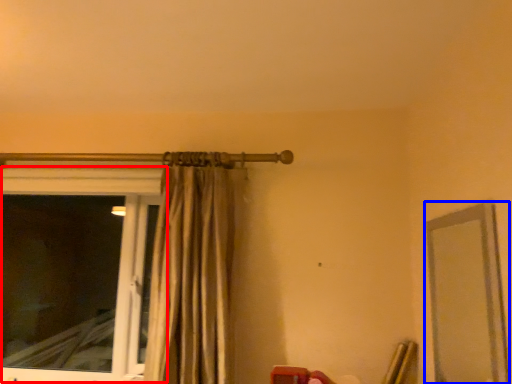
Question: Among these objects, which one is farthest to the camera, window (highlighted by a red box) or mirror (highlighted by a blue box)?

Choices:
 (A) window
 (B) mirror

Answer: (A)